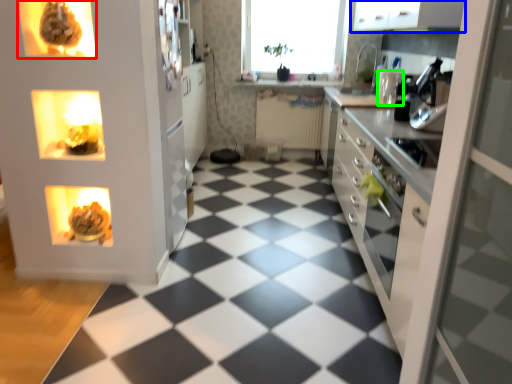
Question: Considering the real-world distances, which object is closest to appliance (highlighted by a red box)? cabinetry (highlighted by a blue box) or appliance (highlighted by a green box).

Choices:
 (A) cabinetry
 (B) appliance

Answer: (A)